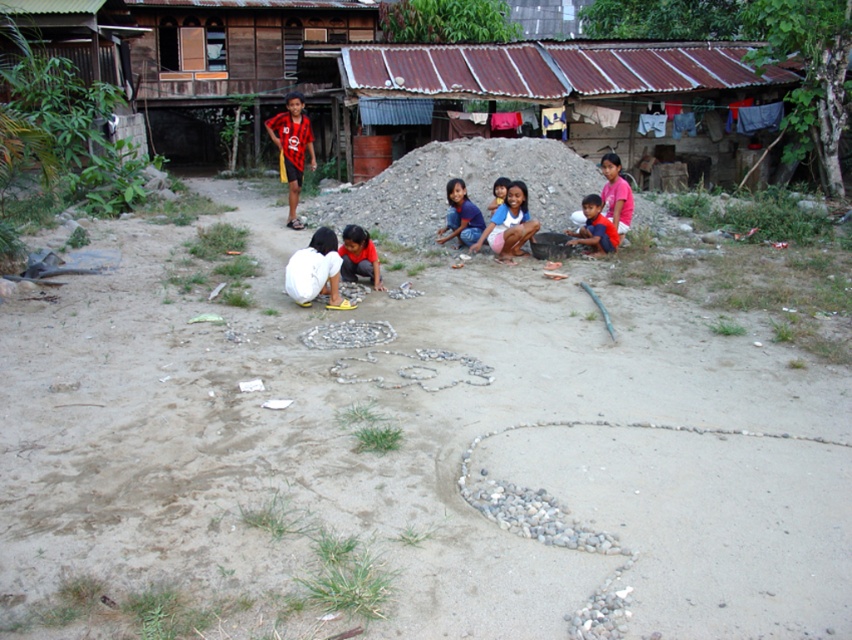
Describe the element at coordinates (315, 269) in the screenshot. I see `white fabric at center` at that location.

Does white fabric at center have a smaller size compared to white matte shirt at center?

Incorrect, white fabric at center is not smaller in size than white matte shirt at center.

Which is in front, point (337, 259) or point (343, 248)?

Point (337, 259) is in front.

Identify the location of white fabric at center. The image size is (852, 640). (315, 269).

Who is more distant from viewer, (x=568, y=54) or (x=606, y=227)?

Positioned behind is point (x=568, y=54).

Between rusty metal hut at upper center and orange t-shirt at center, which one is positioned lower?

orange t-shirt at center

Is point (579, 83) farther from viewer compared to point (585, 221)?

Yes.

Locate an element on the screen. This screenshot has height=640, width=852. rusty metal hut at upper center is located at coordinates (559, 77).

Between brown sandy dirt field at center and red striped shirt at center, which one appears on the right side from the viewer's perspective?

brown sandy dirt field at center is more to the right.

Does brown sandy dirt field at center have a lesser height compared to red striped shirt at center?

Correct, brown sandy dirt field at center is not as tall as red striped shirt at center.

Find the location of a particular element. This screenshot has height=640, width=852. brown sandy dirt field at center is located at coordinates (406, 454).